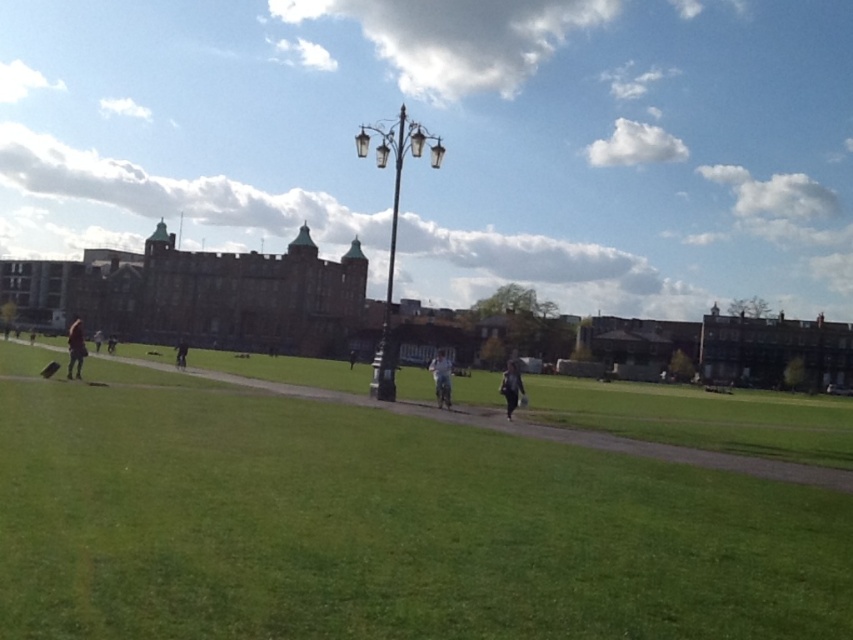
You are standing at the point with coordinates point [102,332] and want to walk to the point with coordinates point [618,442]. Which direction should you move to get closer to your destination?

You should move towards the direction away from the viewer because point [618,442] is closer to the viewer than point [102,332].

In the scene shown: You are standing in the park and notice the green grass at lower center and the dark gray pants at left. Which area takes up more visual space in the image?

The dark gray pants at left occupies more space than the green grass at lower center.

You are a photographer trying to capture a candid shot of both the dark blue jeans at lower left and the dark gray pants at left. Since you want to ensure both are in focus, you need to know their relative heights. Which of the two has a shorter height?

The dark blue jeans at lower left has a lesser height compared to dark gray pants at left, so the dark blue jeans at lower left is shorter in height.